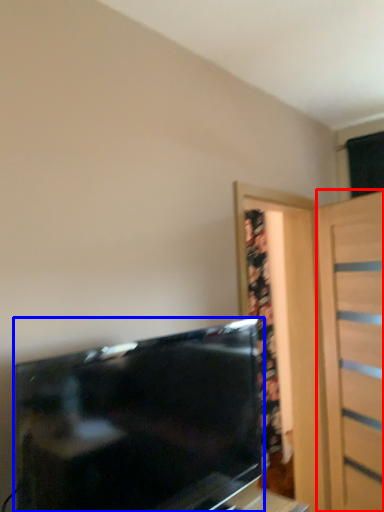
Question: Which object is closer to the camera taking this photo, door (highlighted by a red box) or television (highlighted by a blue box)?

Choices:
 (A) door
 (B) television

Answer: (B)